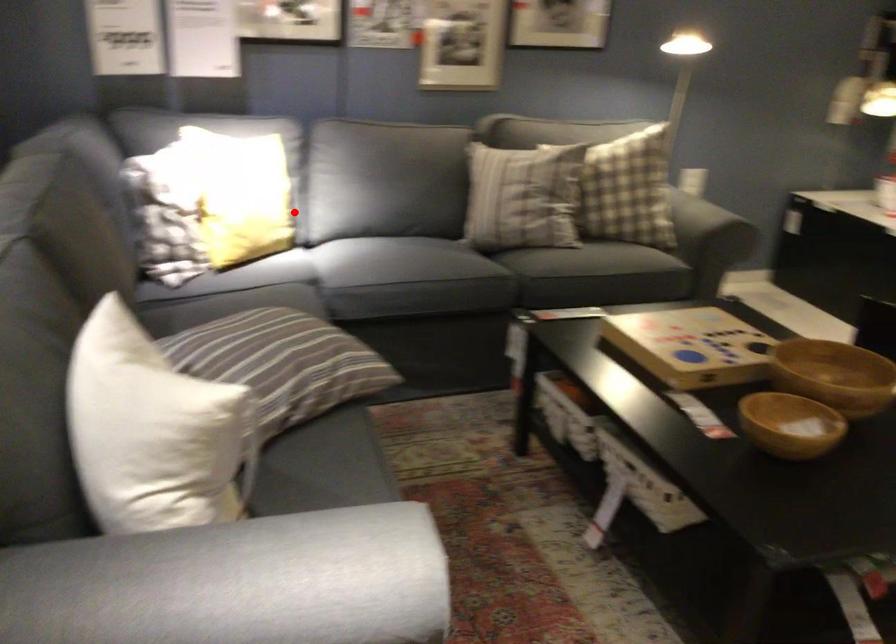
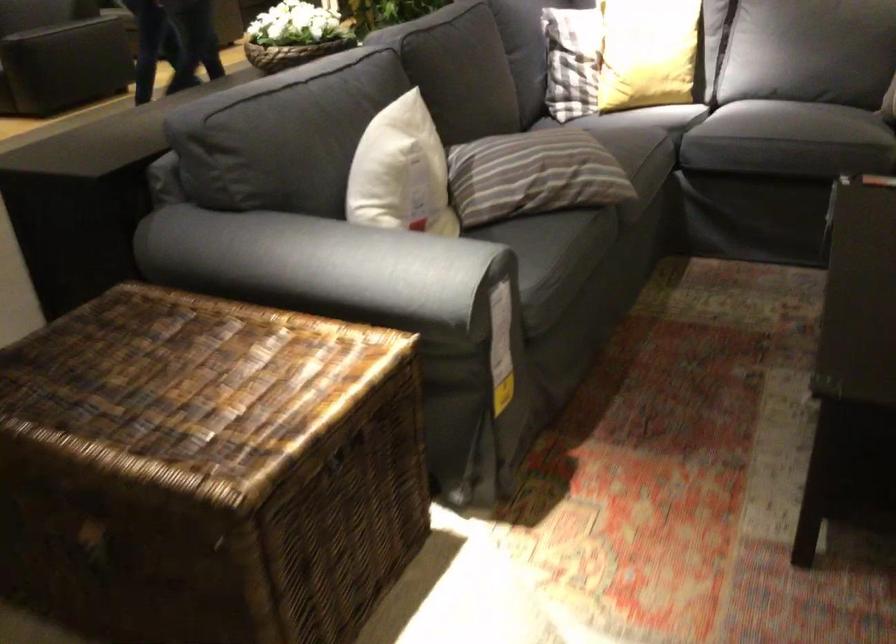
Find the pixel in the second image that matches the highlighted location in the first image.

(647, 53)